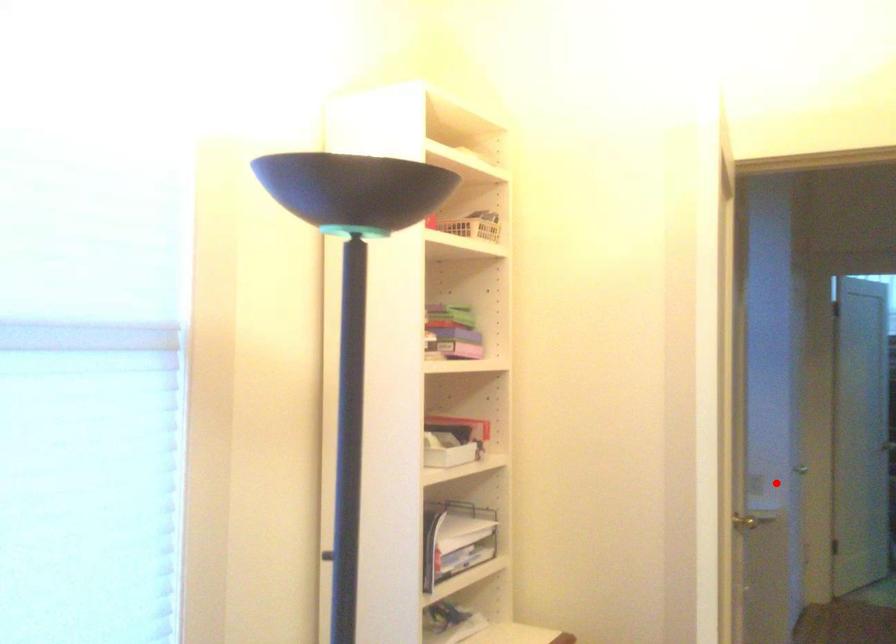
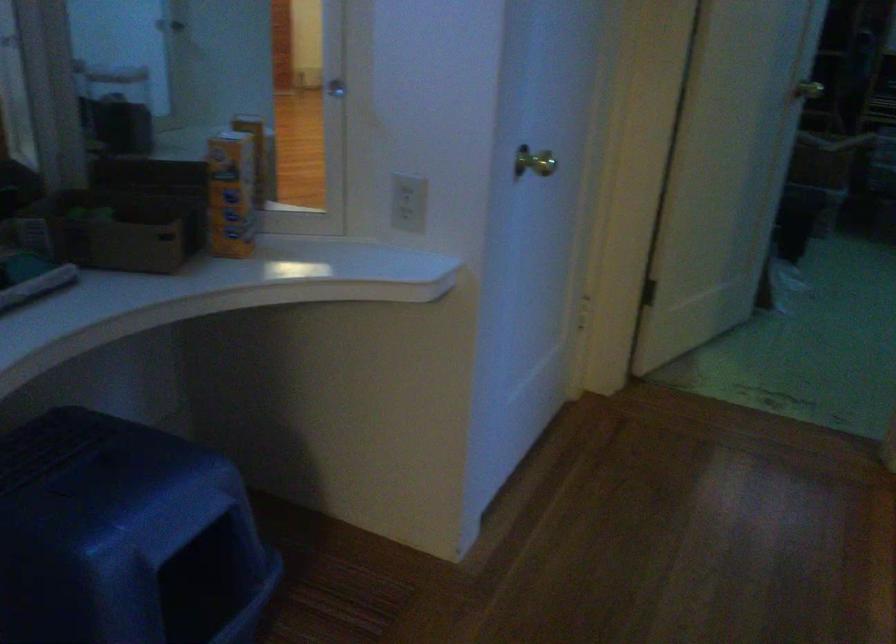
Question: I am providing you with two images of the same scene from different viewpoints. A red point is shown in image1. For the corresponding object point in image2, is it positioned nearer or farther from the camera?

Choices:
 (A) Nearer
 (B) Farther

Answer: (A)